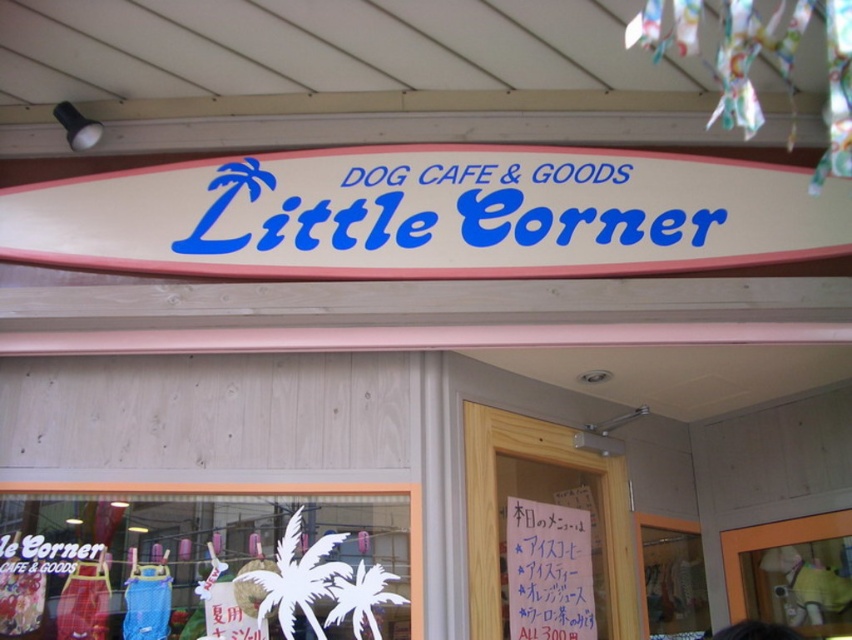
You are a customer approaching the entrance of Little Corner. You see a white matte surfboard at center and a white paper at center. Which object is nearer to you as you stand in front of the entrance?

The white matte surfboard at center is closer to the viewer than the white paper at center, so the white matte surfboard at center is nearer to you.

You are a delivery person who needs to place a small package on the entrance glass window of Little Corner. The package is 1.2 meters wide. Can you fit it between the white matte surfboard at center and the white paper at center?

The distance between the white matte surfboard at center and the white paper at center is 1.17 meters, which is slightly narrower than the package width of 1.2 meters. Therefore, the package cannot fit between them.

You are a customer standing in front of the Little Corner store. You see a white matte surfboard at center and a white paper at center. Which object is shorter?

The white matte surfboard at center is shorter than the white paper at center.